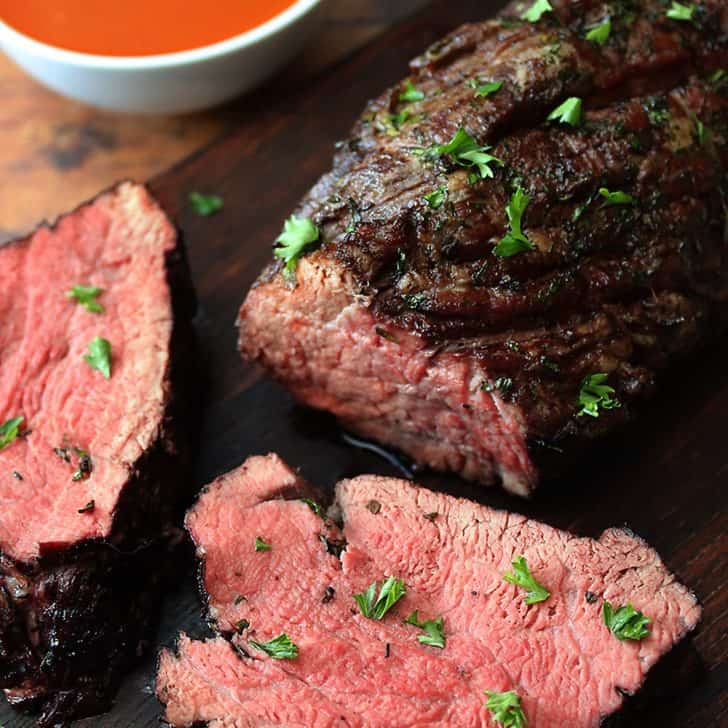
Locate an element on the screen. The image size is (728, 728). table is located at coordinates (54, 164).